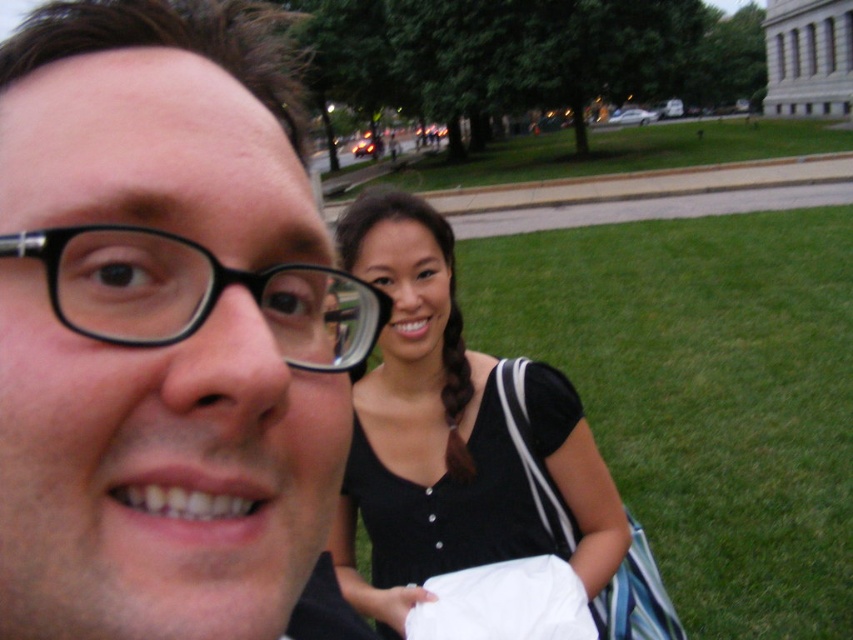
Is black matte glasses at upper left to the left of black plastic glasses at center from the viewer's perspective?

Correct, you'll find black matte glasses at upper left to the left of black plastic glasses at center.

Can you confirm if black matte glasses at upper left is wider than black plastic glasses at center?

Correct, the width of black matte glasses at upper left exceeds that of black plastic glasses at center.

Between point (247, 371) and point (138, 326), which one is positioned in front?

Point (247, 371)

Identify the location of black matte glasses at upper left. The image size is (853, 640). (165, 342).

Between green grass at lower right and green grass at center, which one is positioned lower?

Positioned lower is green grass at lower right.

Can you confirm if green grass at lower right is shorter than green grass at center?

Indeed, green grass at lower right has a lesser height compared to green grass at center.

What do you see at coordinates (703, 396) in the screenshot? This screenshot has height=640, width=853. I see `green grass at lower right` at bounding box center [703, 396].

Identify the location of green grass at lower right. (703, 396).

Describe the element at coordinates (703, 396) in the screenshot. I see `green grass at lower right` at that location.

Find the location of a particular element. This screenshot has width=853, height=640. green grass at lower right is located at coordinates (703, 396).